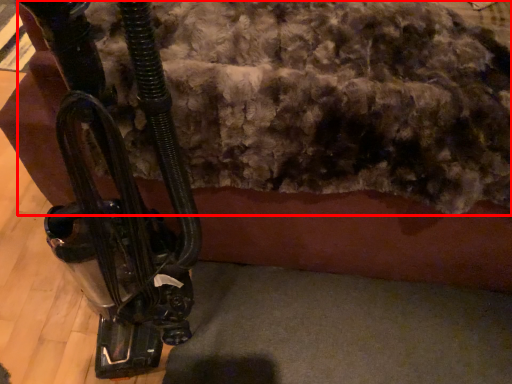
Question: From the image, what is the correct spatial relationship of wool (annotated by the red box) in relation to vehicle?

Choices:
 (A) left
 (B) right

Answer: (B)